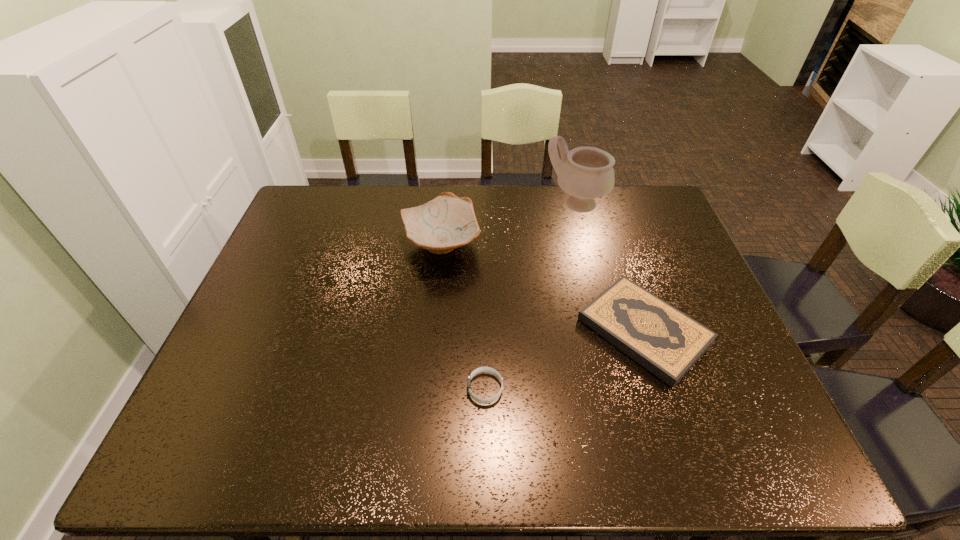
You are a GUI agent. You are given a task and a screenshot of the screen. Output one action in this format:
    pyautogui.click(x=<x>, y=<y>)
    Task: Click on the closest object to the tallest object
    The image size is (960, 540).
    Given the screenshot: What is the action you would take?
    pyautogui.click(x=447, y=222)

At what (x,y) coordinates should I click in order to perform the action: click on free space that satisfies the following two spatial constraints: 1. on the front side of the shorter pottery; 2. on the left side of the hardback book. Please return your answer as a coordinate pair (x, y). The width and height of the screenshot is (960, 540). Looking at the image, I should click on (433, 331).